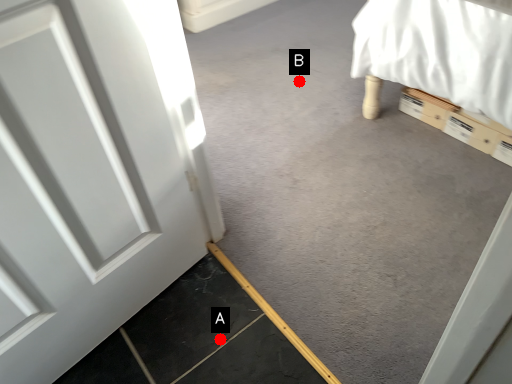
Question: Two points are circled on the image, labeled by A and B beside each circle. Among these points, which one is nearest to the camera?

Choices:
 (A) A is closer
 (B) B is closer

Answer: (A)